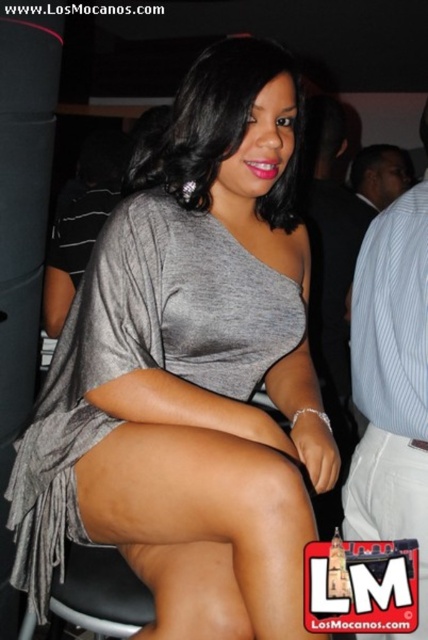
Which is above, gray matte dress at center or white cotton shorts at lower right?

gray matte dress at center is above.

Between point (276, 397) and point (409, 506), which one is positioned in front?

Point (409, 506) is more forward.

Image resolution: width=428 pixels, height=640 pixels. I want to click on gray matte dress at center, so click(190, 372).

Is light blue striped shirt at right taller than white cotton shorts at lower right?

Correct, light blue striped shirt at right is much taller as white cotton shorts at lower right.

Can you confirm if light blue striped shirt at right is positioned below white cotton shorts at lower right?

Incorrect, light blue striped shirt at right is not positioned below white cotton shorts at lower right.

Which is behind, point (419, 579) or point (421, 476)?

Point (421, 476)

Find the location of a particular element. This screenshot has height=640, width=428. light blue striped shirt at right is located at coordinates (392, 385).

Which is behind, point (163, 214) or point (350, 323)?

Point (350, 323)

Does gray matte dress at center appear on the right side of light blue striped shirt at right?

No, gray matte dress at center is not to the right of light blue striped shirt at right.

Does point (238, 294) come farther from viewer compared to point (380, 474)?

No, (238, 294) is closer to viewer.

What are the coordinates of `gray matte dress at center` in the screenshot? It's located at (190, 372).